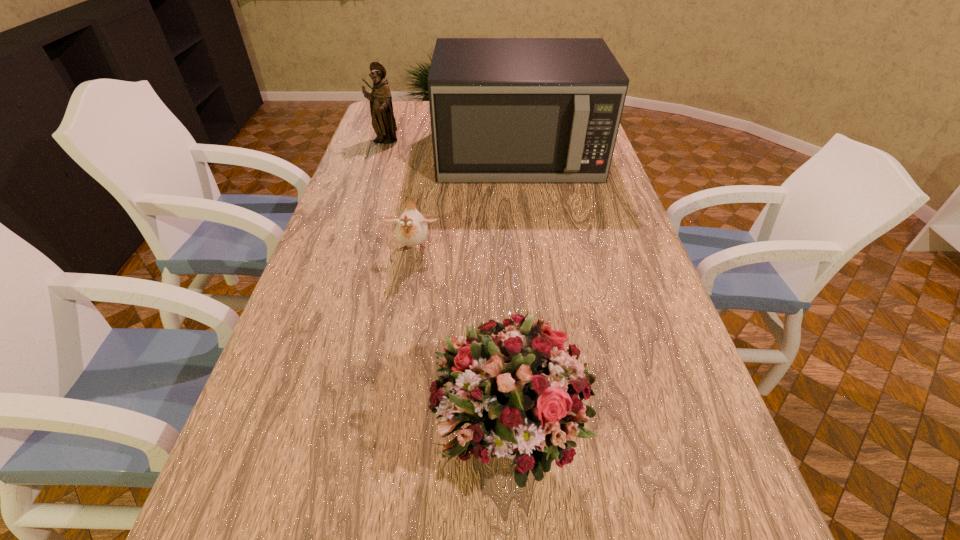
Image resolution: width=960 pixels, height=540 pixels. Identify the location of the tallest object. point(503,110).

Locate an element on the screen. This screenshot has height=540, width=960. the leftmost object is located at coordinates (383, 122).

In order to click on bouquet in this screenshot , I will do `click(522, 392)`.

Locate an element on the screen. The width and height of the screenshot is (960, 540). the shortest object is located at coordinates (411, 229).

Where is `the third farthest object`? The width and height of the screenshot is (960, 540). the third farthest object is located at coordinates (411, 229).

You are a GUI agent. You are given a task and a screenshot of the screen. Output one action in this format:
    pyautogui.click(x=<x>, y=<y>)
    Task: Click on the vacant area situated 0.140m on the front-facing side of the tallest object
    The height and width of the screenshot is (540, 960).
    Given the screenshot: What is the action you would take?
    pyautogui.click(x=525, y=217)

This screenshot has width=960, height=540. I want to click on free space located 0.090m on the front-facing side of the leftmost object, so click(x=378, y=161).

Where is `vacant region located 0.090m on the right of the nearest object`? The height and width of the screenshot is (540, 960). vacant region located 0.090m on the right of the nearest object is located at coordinates (630, 434).

Image resolution: width=960 pixels, height=540 pixels. Identify the location of blank space located at the beak of the third farthest object. (400, 328).

Where is `object at the left edge`? This screenshot has height=540, width=960. object at the left edge is located at coordinates (383, 122).